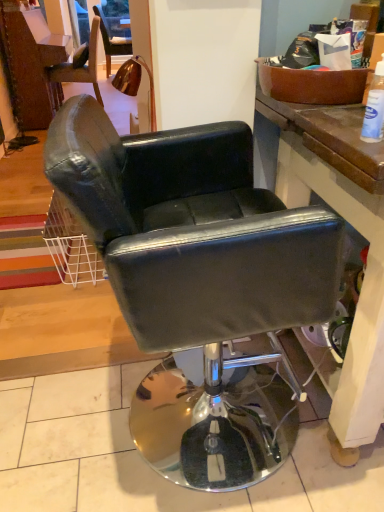
Describe the element at coordinates (199, 283) in the screenshot. I see `black leather chair at center` at that location.

Locate an element on the screen. The image size is (384, 512). black leather chair at center is located at coordinates (199, 283).

Find the location of a particular element. The height and width of the screenshot is (512, 384). white plastic bottle at upper right is located at coordinates (374, 106).

What do you see at coordinates (374, 106) in the screenshot? The height and width of the screenshot is (512, 384). I see `white plastic bottle at upper right` at bounding box center [374, 106].

You are a GUI agent. You are given a task and a screenshot of the screen. Output one action in this format:
    pyautogui.click(x=<x>, y=<y>)
    Task: Click on the black leather chair at center
    
    Given the screenshot: What is the action you would take?
    pyautogui.click(x=199, y=283)

Consider the image. Is black leather chair at center at the right side of white plastic bottle at upper right?

Incorrect, black leather chair at center is not on the right side of white plastic bottle at upper right.

Considering their positions, is black leather chair at center located in front of or behind white plastic bottle at upper right?

Visually, black leather chair at center is located in front of white plastic bottle at upper right.

Looking at this image, which point is more forward, (102, 136) or (380, 91)?

The point (102, 136) is in front.

From the image's perspective, is black leather chair at center located beneath white plastic bottle at upper right?

Yes, from the image's perspective, black leather chair at center is beneath white plastic bottle at upper right.

From a real-world perspective, does black leather chair at center stand above white plastic bottle at upper right?

Actually, black leather chair at center is physically below white plastic bottle at upper right in the real world.

Which of these two, black leather chair at center or white plastic bottle at upper right, is thinner?

white plastic bottle at upper right.

Considering the sizes of objects black leather chair at center and white plastic bottle at upper right in the image provided, who is taller, black leather chair at center or white plastic bottle at upper right?

Standing taller between the two is black leather chair at center.

Considering the sizes of black leather chair at center and white plastic bottle at upper right in the image, is black leather chair at center bigger or smaller than white plastic bottle at upper right?

black leather chair at center is bigger than white plastic bottle at upper right.

Do you think black leather chair at center is within white plastic bottle at upper right, or outside of it?

black leather chair at center is not inside white plastic bottle at upper right, it's outside.

Are black leather chair at center and white plastic bottle at upper right making contact?

black leather chair at center and white plastic bottle at upper right are clearly separated.

Is black leather chair at center oriented away from white plastic bottle at upper right?

That's not correct — black leather chair at center is not looking away from white plastic bottle at upper right.

How different are the orientations of black leather chair at center and white plastic bottle at upper right in degrees?

The angular difference between black leather chair at center and white plastic bottle at upper right is 0.000623 degrees.

I want to click on chair that appears below the white plastic bottle at upper right (from the image's perspective), so click(199, 283).

Is white plastic bottle at upper right to the left or to the right of black leather chair at center in the image?

Clearly, white plastic bottle at upper right is on the right of black leather chair at center in the image.

From the picture: Relative to black leather chair at center, is white plastic bottle at upper right in front or behind?

Clearly, white plastic bottle at upper right is behind black leather chair at center.

Which is more distant, (374, 74) or (265, 219)?

The point (374, 74) is farther.

From the image's perspective, is white plastic bottle at upper right on black leather chair at center?

Indeed, from the image's perspective, white plastic bottle at upper right is shown above black leather chair at center.

From a real-world perspective, is white plastic bottle at upper right physically located above or below black leather chair at center?

Clearly, from a real-world perspective, white plastic bottle at upper right is above black leather chair at center.

Is white plastic bottle at upper right thinner than black leather chair at center?

Indeed, white plastic bottle at upper right has a lesser width compared to black leather chair at center.

Which of these two, white plastic bottle at upper right or black leather chair at center, stands shorter?

white plastic bottle at upper right.

Can you confirm if white plastic bottle at upper right is smaller than black leather chair at center?

Yes, white plastic bottle at upper right is smaller than black leather chair at center.

From the picture: Would you say white plastic bottle at upper right is outside black leather chair at center?

white plastic bottle at upper right lies outside black leather chair at center's area.

Is white plastic bottle at upper right far from black leather chair at center?

That's not correct — white plastic bottle at upper right is a little close to black leather chair at center.

Is white plastic bottle at upper right facing towards black leather chair at center?

No, white plastic bottle at upper right is not oriented towards black leather chair at center.

How different are the orientations of white plastic bottle at upper right and black leather chair at center in degrees?

0.000623 degrees.

How distant is white plastic bottle at upper right from black leather chair at center?

white plastic bottle at upper right is 16.44 inches from black leather chair at center.

What are the coordinates of `chair in front of the white plastic bottle at upper right` in the screenshot? It's located at (199, 283).

This screenshot has width=384, height=512. Identify the location of chair on the left side of white plastic bottle at upper right. (199, 283).

This screenshot has height=512, width=384. Find the location of `chair below the white plastic bottle at upper right (from a real-world perspective)`. chair below the white plastic bottle at upper right (from a real-world perspective) is located at coordinates point(199,283).